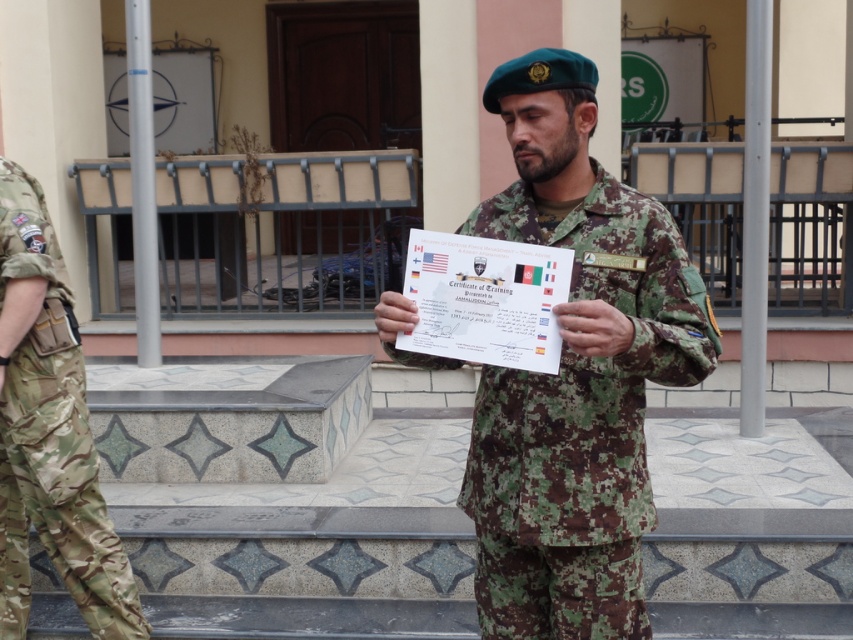
Question: Is camouflage uniform at center positioned behind camouflage fabric pants at left?

Choices:
 (A) no
 (B) yes

Answer: (A)

Question: Is camouflage uniform at center below camouflage fabric pants at left?

Choices:
 (A) yes
 (B) no

Answer: (B)

Question: Which point appears farthest from the camera in this image?

Choices:
 (A) (70, 304)
 (B) (592, 122)

Answer: (A)

Question: Can you confirm if camouflage uniform at center is positioned below camouflage fabric pants at left?

Choices:
 (A) yes
 (B) no

Answer: (B)

Question: Which of the following is the farthest from the observer?

Choices:
 (A) camouflage fabric pants at left
 (B) camouflage uniform at center

Answer: (A)

Question: Which object is farther from the camera taking this photo?

Choices:
 (A) camouflage uniform at center
 (B) camouflage fabric pants at left

Answer: (B)